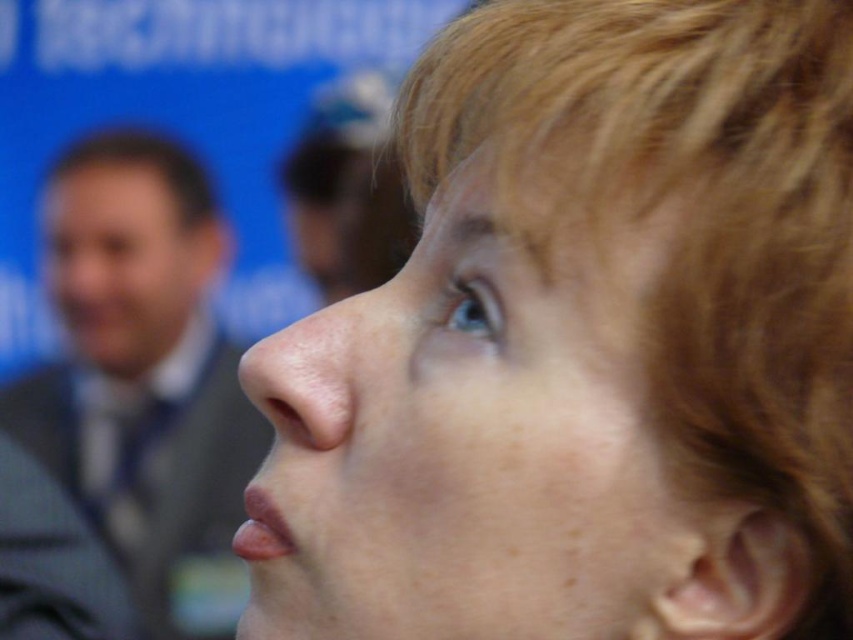
You are observing a group photo where the matte gray suit at upper left and the brown matte hair at left are visible. Which object is positioned higher in the image?

The brown matte hair at left is positioned higher in the image than the matte gray suit at upper left.